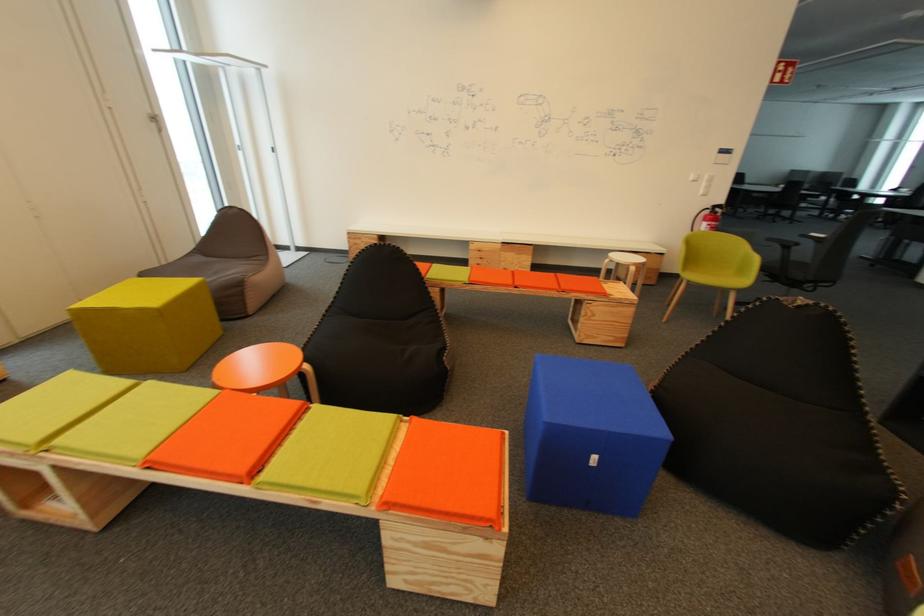
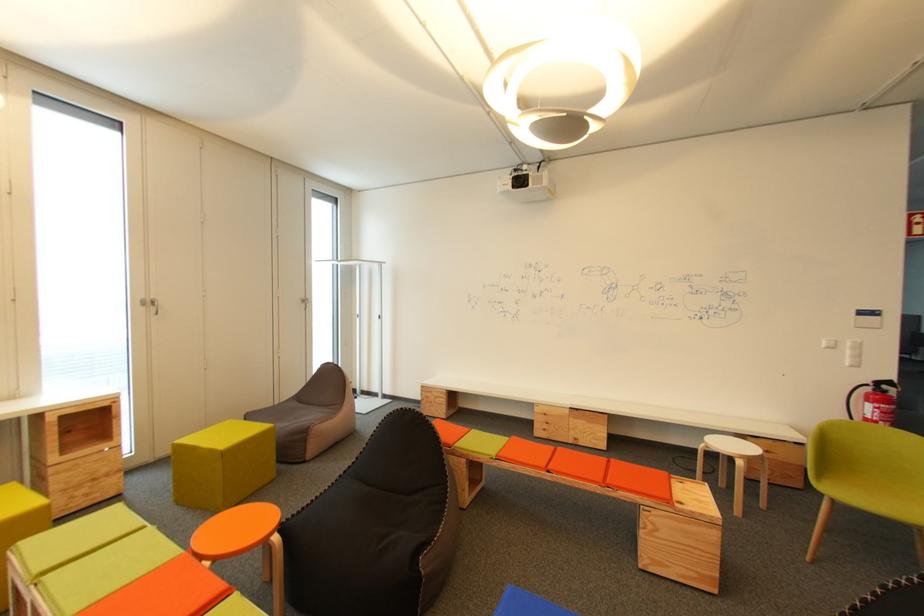
First-person continuous shooting, in which direction is the camera rotating?

The rotation direction of the camera is left-up.